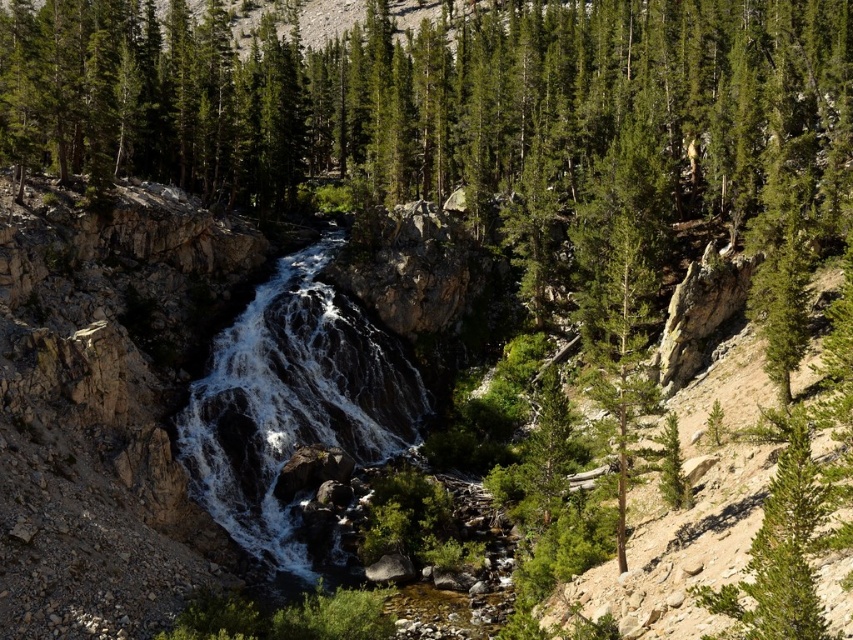
Question: Is white frothy water at center smaller than green matte tree at center-right?

Choices:
 (A) no
 (B) yes

Answer: (A)

Question: Does white frothy water at center appear over green matte tree at center-right?

Choices:
 (A) no
 (B) yes

Answer: (A)

Question: Among these points, which one is farthest from the camera?

Choices:
 (A) (328, 346)
 (B) (641, 285)

Answer: (A)

Question: Is white frothy water at center positioned before green matte tree at center-right?

Choices:
 (A) no
 (B) yes

Answer: (A)